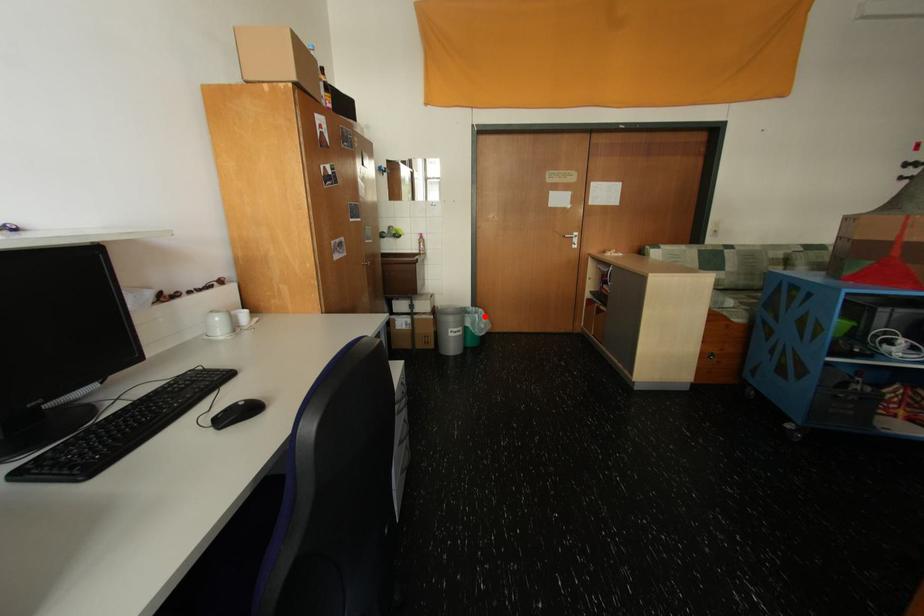
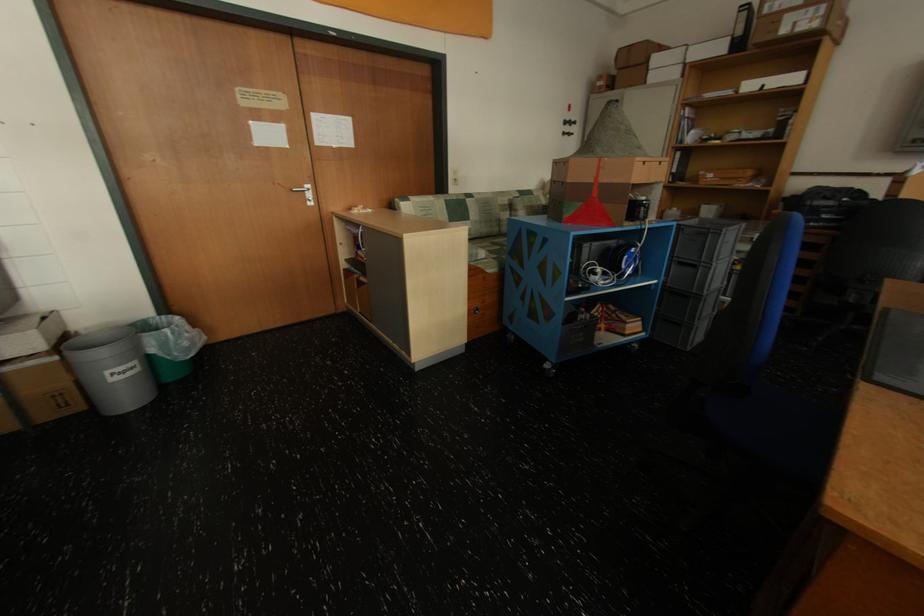
Question: I am providing you with two images of the same scene from different viewpoints. Image1 has a red point marked. In image2, the corresponding 3D location appears at what relative position? Reply with the corresponding letter.

Choices:
 (A) Closer
 (B) Farther

Answer: (A)